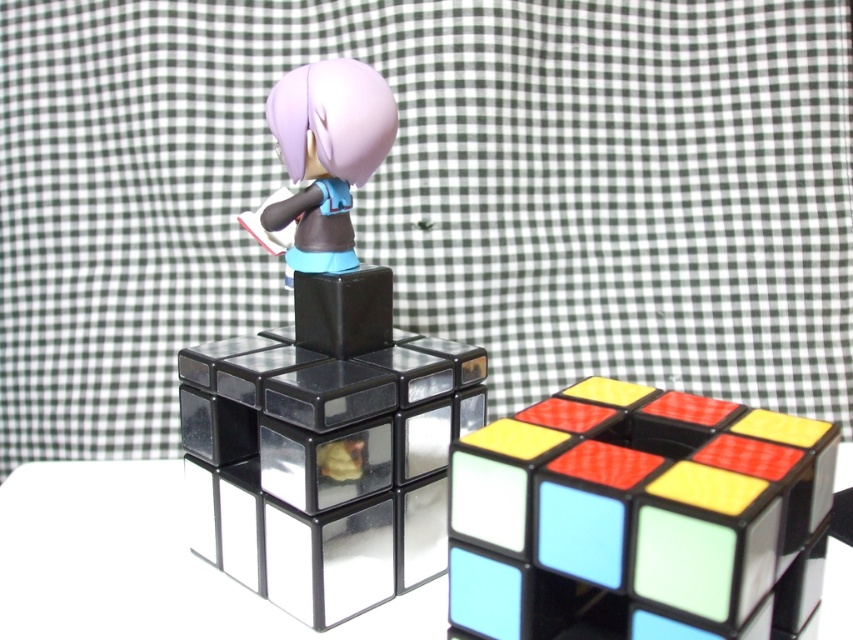
Question: Where is matte black figurine at center located in relation to rubberized plastic rubik's cube at center in the image?

Choices:
 (A) right
 (B) left

Answer: (B)

Question: In this image, where is matte black figurine at center located relative to matte plastic doll at center?

Choices:
 (A) above
 (B) below

Answer: (B)

Question: Which point is closer to the camera?

Choices:
 (A) matte plastic doll at center
 (B) matte black figurine at center
 (C) rubberized plastic rubik's cube at center

Answer: (C)

Question: Among these objects, which one is farthest from the camera?

Choices:
 (A) matte black figurine at center
 (B) rubberized plastic rubik's cube at center

Answer: (A)

Question: Which of the following is the closest to the observer?

Choices:
 (A) (286, 253)
 (B) (294, 564)
 (C) (518, 490)

Answer: (C)

Question: Is matte black figurine at center positioned behind matte plastic doll at center?

Choices:
 (A) yes
 (B) no

Answer: (B)